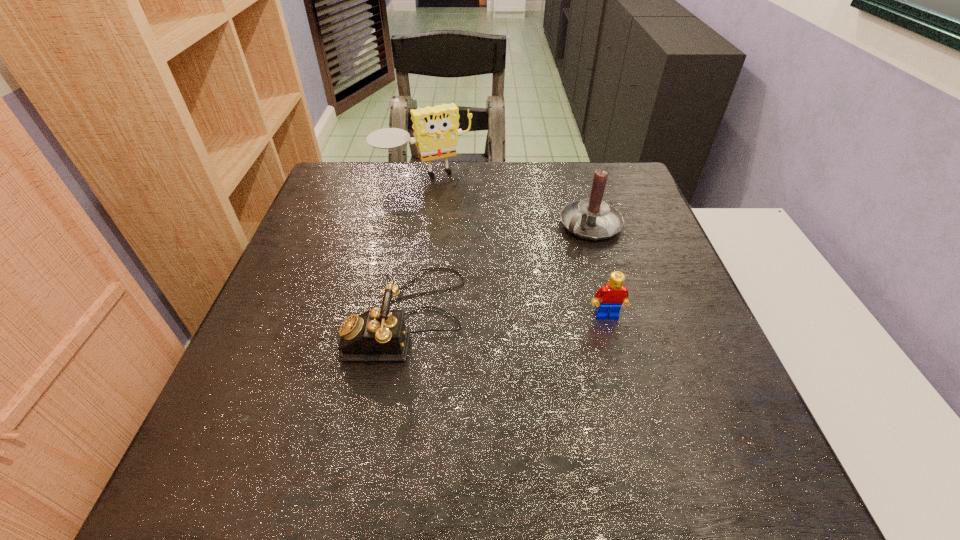
Where is `vacant space on the desktop that is between the telephone and the Lego and is positioned on the side of the candle with the handle loop`? The image size is (960, 540). vacant space on the desktop that is between the telephone and the Lego and is positioned on the side of the candle with the handle loop is located at coordinates (481, 316).

Locate an element on the screen. free space on the desktop that is between the telephone and the Lego and is positioned on the front-facing side of the tallest object is located at coordinates (504, 316).